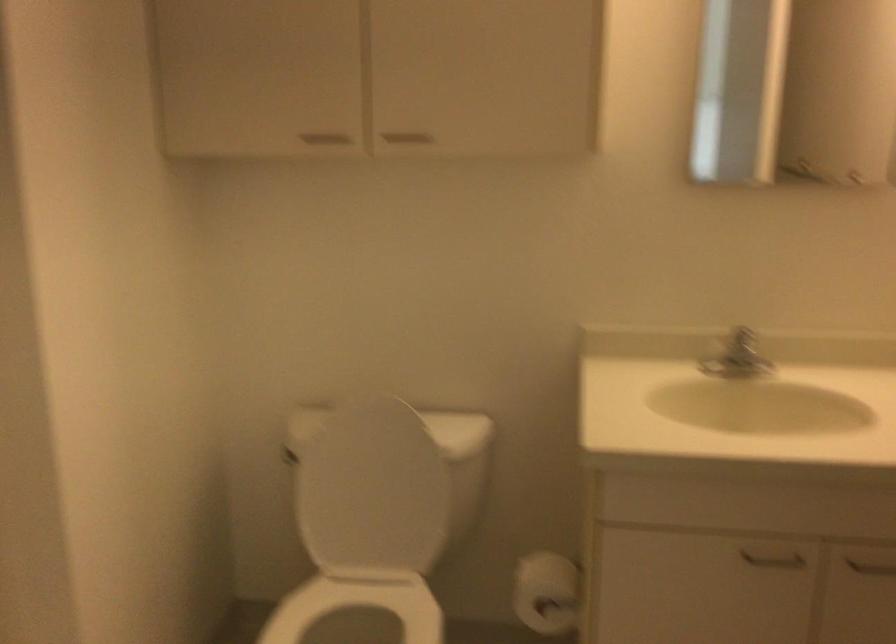
I want to click on white toilet seat, so click(x=357, y=605).